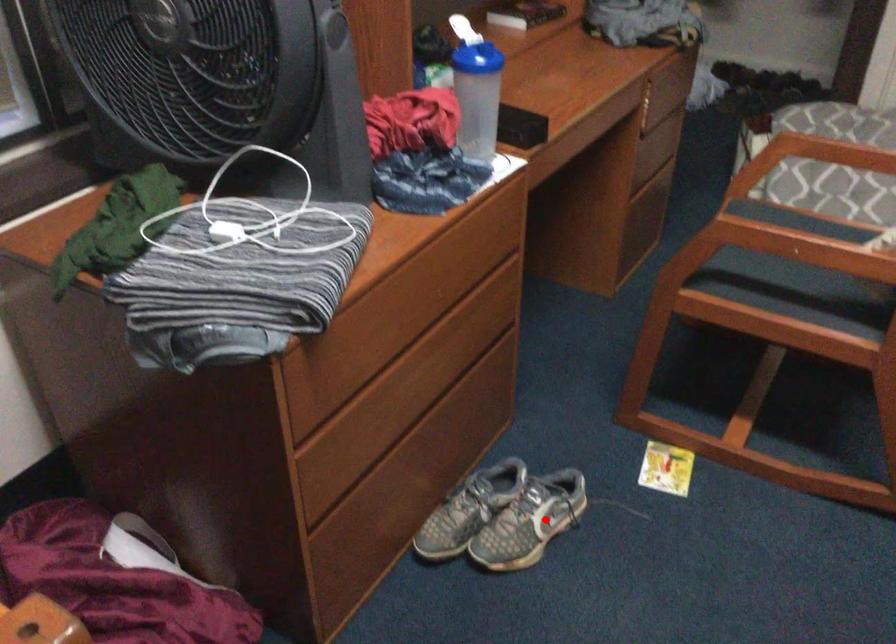
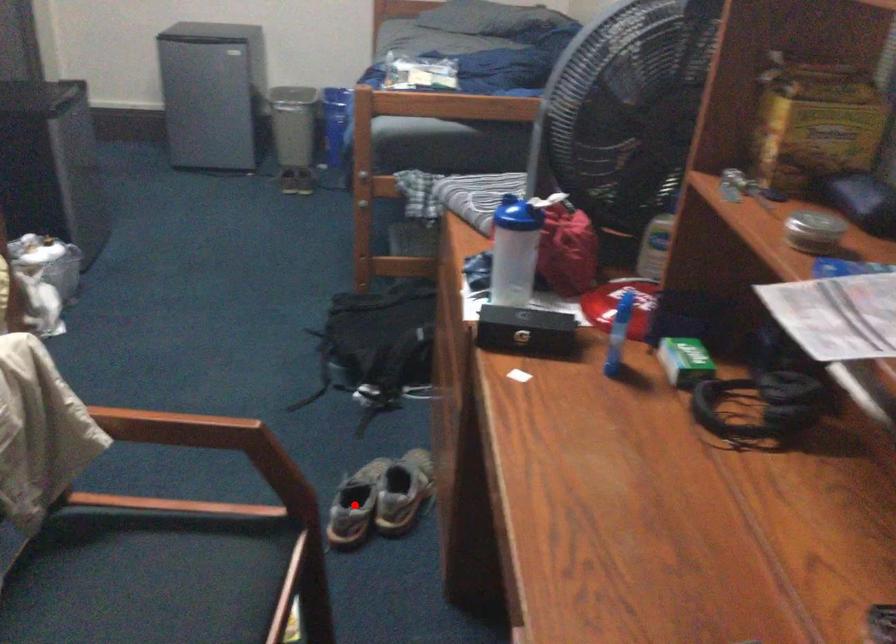
I am providing you with two images of the same scene from different viewpoints. A red point is marked on the first image and another point is marked on the second image. Do the highlighted points in image1 and image2 indicate the same real-world spot?

Yes